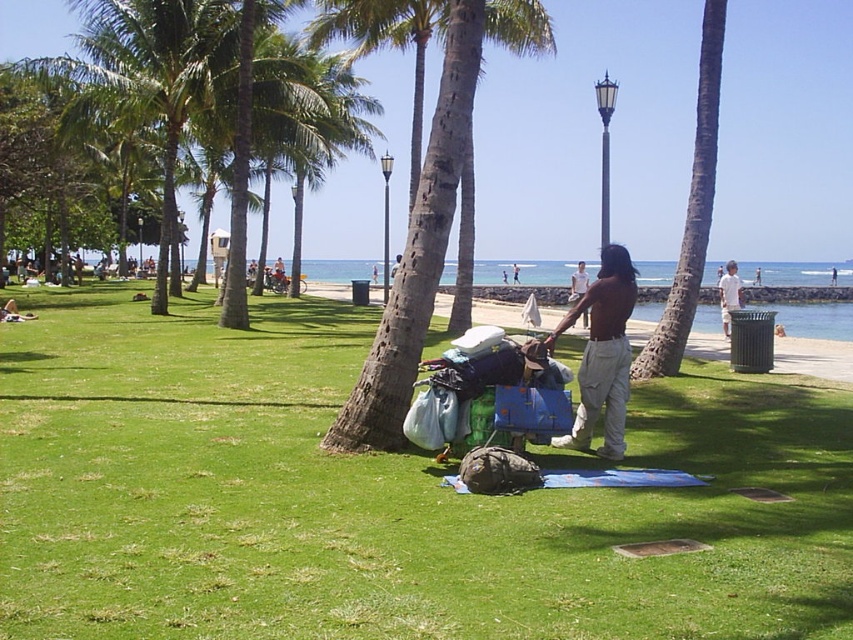
You are a photographer trying to capture a photo of the brown cotton shirt at center and the green grass at center. Since you want both subjects in focus, you need to know their positions relative to each other. Which object is positioned to the left of the other?

The green grass at center is to the left of brown cotton shirt at center according to the description.

You are a photographer trying to capture the brown rough bark palm tree at center and the brown cotton shirt at center in the same frame. Based on their positions, which object should you focus on first to ensure both are in the shot?

The brown rough bark palm tree at center is positioned over the brown cotton shirt at center, so you should focus on the palm tree first to ensure both are in the shot.

You are a photographer aiming to capture a clear shot of the person at the beach. Since the green grass at center and brown hair at center are both in the foreground, which object should you focus on to ensure the subject is sharp?

The green grass at center is much taller than the brown hair at center, so focusing on the brown hair at center would ensure the subject is sharp as it is closer to the camera.